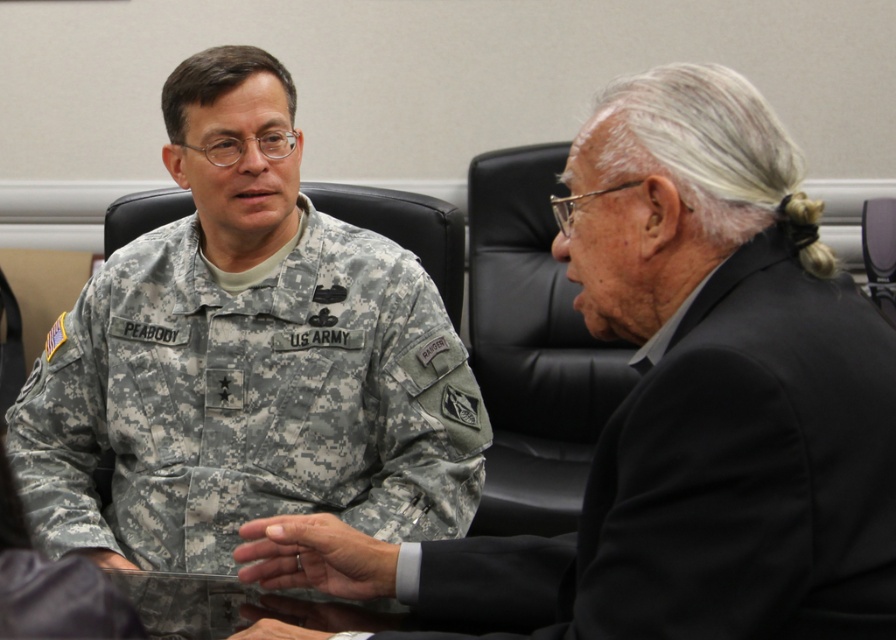
Question: Can you confirm if camouflage fabric at center is wider than matte black hand at center?

Choices:
 (A) yes
 (B) no

Answer: (A)

Question: Which object is farther from the camera taking this photo?

Choices:
 (A) camouflage fabric uniform at center
 (B) camouflage fabric at center
 (C) black matte suit at right
 (D) matte black hand at center

Answer: (A)

Question: Which object is farther from the camera taking this photo?

Choices:
 (A) camouflage fabric at center
 (B) camouflage fabric uniform at center

Answer: (B)

Question: Considering the relative positions of camouflage fabric uniform at center and camouflage fabric at center in the image provided, where is camouflage fabric uniform at center located with respect to camouflage fabric at center?

Choices:
 (A) right
 (B) left

Answer: (B)

Question: Where is camouflage fabric at center located in relation to matte black hand at center in the image?

Choices:
 (A) right
 (B) left

Answer: (A)

Question: Which object is farther from the camera taking this photo?

Choices:
 (A) matte black hand at center
 (B) black matte suit at right

Answer: (A)